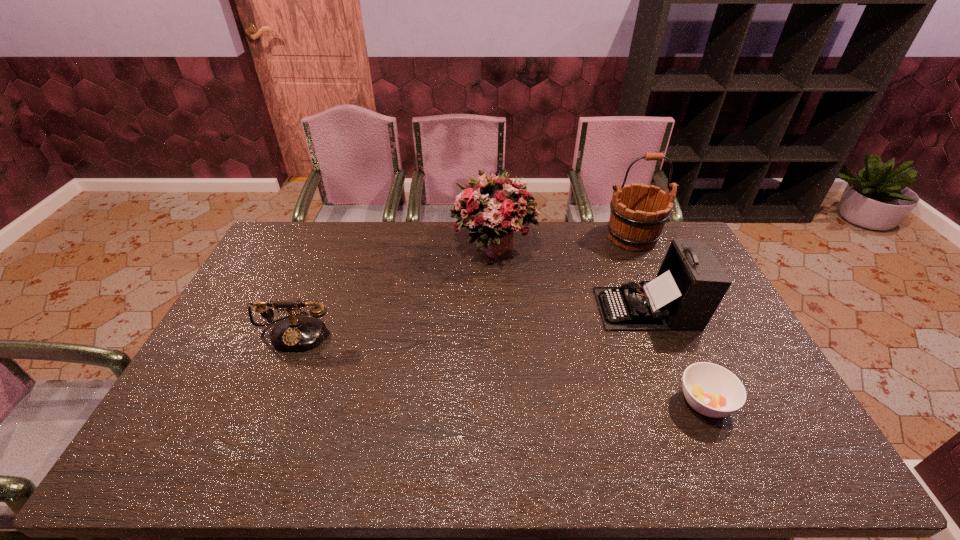
This screenshot has height=540, width=960. What are the coordinates of `free location that satisfies the following two spatial constraints: 1. inside the open case of the soup bowl; 2. on the left side of the third tallest object` in the screenshot? It's located at (685, 402).

You are a GUI agent. You are given a task and a screenshot of the screen. Output one action in this format:
    pyautogui.click(x=<x>, y=<y>)
    Task: Click on the free space that satisfies the following two spatial constraints: 1. inside the open case of the third shortest object; 2. on the back side of the nearest object
    
    Given the screenshot: What is the action you would take?
    [685, 402]

Find the location of a particular element. free location that satisfies the following two spatial constraints: 1. on the dial of the second shortest object; 2. on the right side of the soup bowl is located at coordinates (267, 402).

Image resolution: width=960 pixels, height=540 pixels. In order to click on vacant space that satisfies the following two spatial constraints: 1. on the front side of the shortest object; 2. on the right side of the second object from left to right in this screenshot , I will do pos(500,402).

Image resolution: width=960 pixels, height=540 pixels. What are the coordinates of `blank space that satisfies the following two spatial constraints: 1. inside the open case of the typewriter; 2. on the left side of the shortest object` in the screenshot? It's located at (685, 402).

Image resolution: width=960 pixels, height=540 pixels. What are the coordinates of `free spot that satisfies the following two spatial constraints: 1. inside the open case of the shortest object; 2. on the left side of the typewriter` in the screenshot? It's located at [685, 402].

The height and width of the screenshot is (540, 960). I want to click on vacant space that satisfies the following two spatial constraints: 1. inside the open case of the typewriter; 2. on the back side of the nearest object, so click(685, 402).

This screenshot has height=540, width=960. Identify the location of vacant space that satisfies the following two spatial constraints: 1. inside the open case of the third tallest object; 2. on the dial of the telephone. (657, 332).

Locate an element on the screen. The width and height of the screenshot is (960, 540). vacant position in the image that satisfies the following two spatial constraints: 1. inside the open case of the typewriter; 2. on the right side of the shortest object is located at coordinates [x=685, y=402].

The height and width of the screenshot is (540, 960). I want to click on vacant region that satisfies the following two spatial constraints: 1. inside the open case of the third tallest object; 2. on the dial of the leftmost object, so click(x=657, y=332).